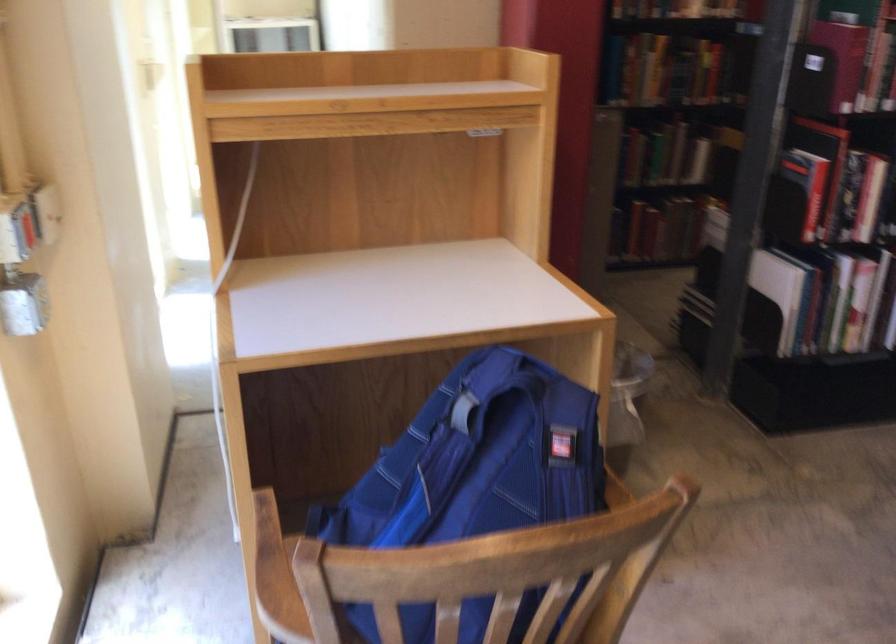
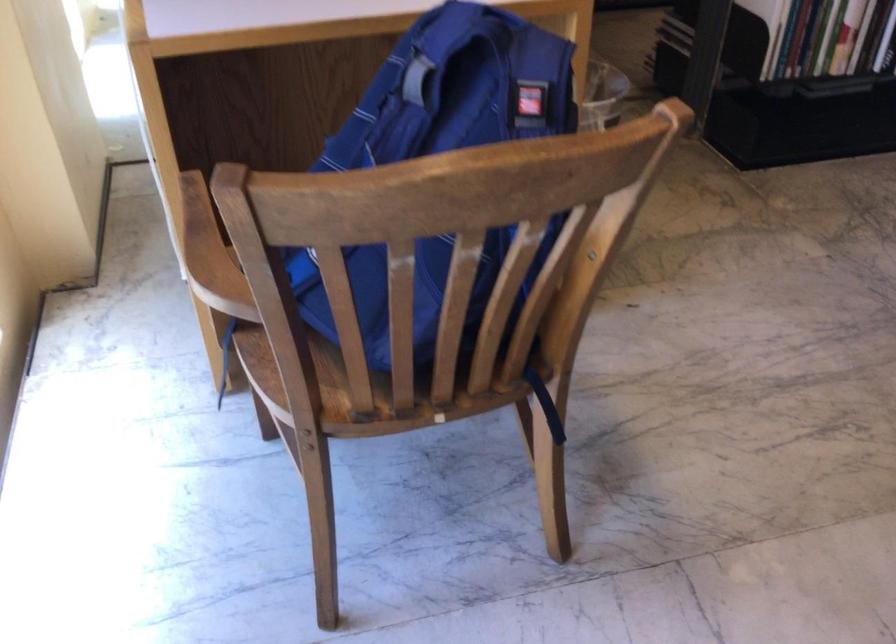
Question: The images are taken continuously from a first-person perspective. In which direction is your viewpoint rotating?

Choices:
 (A) Left
 (B) Right
 (C) Up
 (D) Down

Answer: (D)